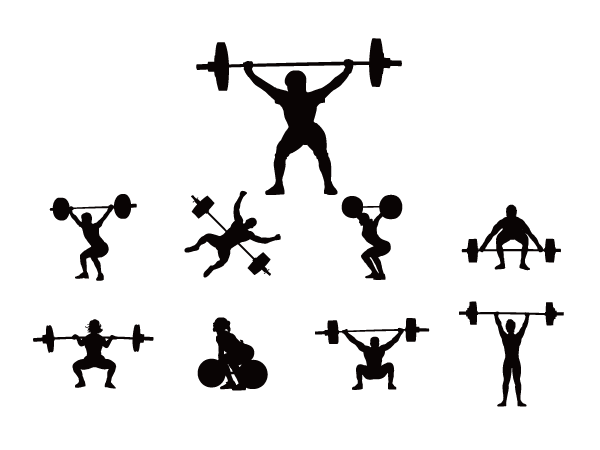
What are the coordinates of `bar` in the screenshot? It's located at (92, 208), (112, 333), (294, 63), (244, 246), (231, 368), (379, 329), (373, 199), (506, 246), (513, 310).